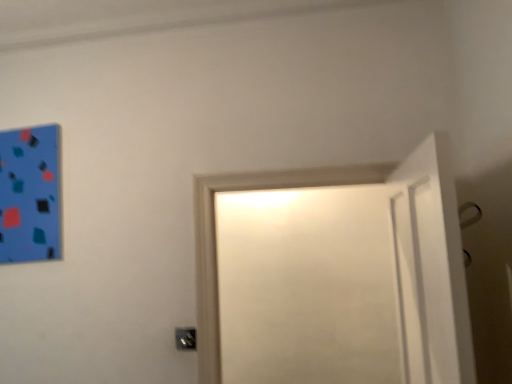
What do you see at coordinates (334, 275) in the screenshot? The height and width of the screenshot is (384, 512). I see `white matte door at center` at bounding box center [334, 275].

In order to face white matte door at center, should I rotate leftwards or rightwards?

It's best to rotate right around 7.100 degrees.

Where is `white matte door at center`? Image resolution: width=512 pixels, height=384 pixels. white matte door at center is located at coordinates (334, 275).

This screenshot has width=512, height=384. Identify the location of white matte door at center. (334, 275).